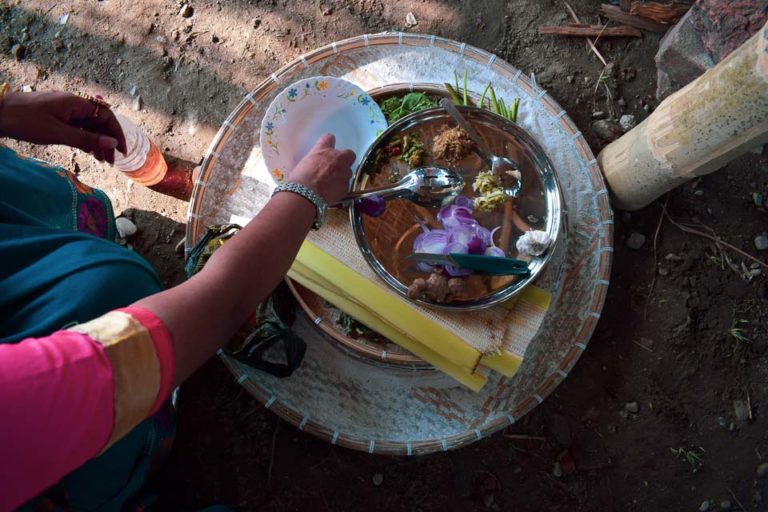
Identify the location of bowl. The image size is (768, 512). (299, 100).